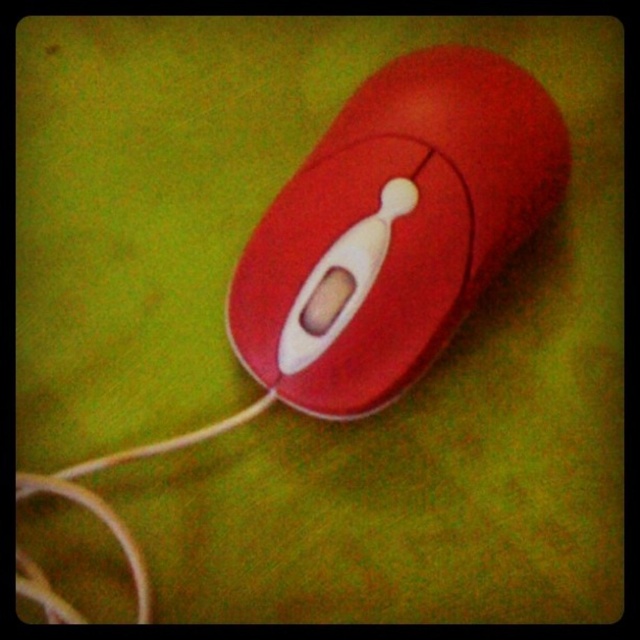
Question: Among these points, which one is nearest to the camera?

Choices:
 (A) (90, 497)
 (B) (353, 157)

Answer: (A)

Question: Does matte plastic mouse at center appear on the left side of white matte string at lower left?

Choices:
 (A) no
 (B) yes

Answer: (A)

Question: Which point appears farthest from the camera in this image?

Choices:
 (A) [x=132, y=556]
 (B) [x=483, y=100]

Answer: (B)

Question: Does matte plastic mouse at center have a greater width compared to white matte string at lower left?

Choices:
 (A) yes
 (B) no

Answer: (A)

Question: Which of the following is the farthest from the observer?

Choices:
 (A) matte plastic mouse at center
 (B) white matte string at lower left

Answer: (A)

Question: Does matte plastic mouse at center have a greater width compared to white matte string at lower left?

Choices:
 (A) yes
 (B) no

Answer: (A)